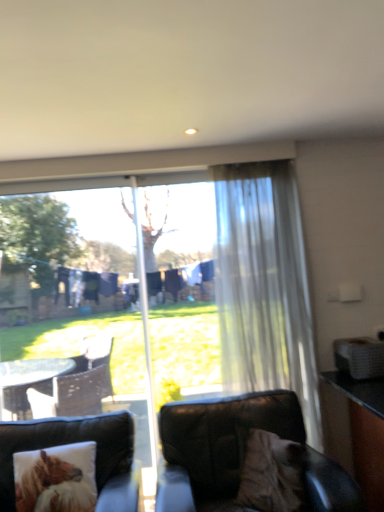
This screenshot has width=384, height=512. Describe the element at coordinates (68, 443) in the screenshot. I see `leather couch at lower left` at that location.

Where is `leather couch at lower left`? This screenshot has height=512, width=384. leather couch at lower left is located at coordinates (68, 443).

In the scene shown: Measure the distance between point (84, 453) and camera.

The depth of point (84, 453) is 7.46 feet.

Measure the distance between point (x=251, y=315) and camera.

Point (x=251, y=315) and camera are 2.75 meters apart.

You are a GUI agent. You are given a task and a screenshot of the screen. Output one action in this format:
    pyautogui.click(x=<x>, y=<y>)
    Task: Click on the black leather chair at lower right
    
    Given the screenshot: What is the action you would take?
    coord(239,454)

Considering the sizes of objects black leather chair at lower right and leather couch at lower left in the image provided, who is wider, black leather chair at lower right or leather couch at lower left?

leather couch at lower left is wider.

Looking at this image, do you think black leather chair at lower right is within leather couch at lower left, or outside of it?

black leather chair at lower right is not inside leather couch at lower left, it's outside.

Can you tell me how much beige fabric pillow at lower right and leather couch at lower left differ in facing direction?

They differ by 54.8 degrees in their facing directions.

Where is `pillow on the right side of leather couch at lower left`? pillow on the right side of leather couch at lower left is located at coordinates click(x=271, y=473).

Considering the sizes of objects beige fabric pillow at lower right and leather couch at lower left in the image provided, who is wider, beige fabric pillow at lower right or leather couch at lower left?

leather couch at lower left is wider.

Is beige fabric pillow at lower right spatially inside leather couch at lower left, or outside of it?

beige fabric pillow at lower right cannot be found inside leather couch at lower left.

In the scene shown: Can you tell me how much leather couch at lower left and beige fabric pillow at lower right differ in facing direction?

The angle between the facing direction of leather couch at lower left and the facing direction of beige fabric pillow at lower right is 54.8 degrees.

Considering the sizes of objects leather couch at lower left and beige fabric pillow at lower right in the image provided, who is shorter, leather couch at lower left or beige fabric pillow at lower right?

Standing shorter between the two is beige fabric pillow at lower right.

Would you say leather couch at lower left is outside beige fabric pillow at lower right?

Absolutely, leather couch at lower left is external to beige fabric pillow at lower right.

From the image's perspective, is leather couch at lower left on top of beige fabric pillow at lower right?

No, from the image's perspective, leather couch at lower left is not over beige fabric pillow at lower right.

From the image's perspective, is black leather chair at lower right under translucent white curtain at right?

Yes.

Considering the points (223, 431) and (276, 359), which point is behind, point (223, 431) or point (276, 359)?

The point (276, 359) is more distant.

Does black leather chair at lower right lie in front of translucent white curtain at right?

Yes, the depth of black leather chair at lower right is less than that of translucent white curtain at right.

Could you tell me if black leather chair at lower right is turned towards translucent white curtain at right?

No.

From the image's perspective, which one is positioned higher, fluffy brown pillow at lower left or beige fabric pillow at lower right?

beige fabric pillow at lower right.

Considering the sizes of objects fluffy brown pillow at lower left and beige fabric pillow at lower right in the image provided, who is thinner, fluffy brown pillow at lower left or beige fabric pillow at lower right?

With smaller width is fluffy brown pillow at lower left.

Could you tell me if fluffy brown pillow at lower left is turned towards beige fabric pillow at lower right?

No.

Is fluffy brown pillow at lower left next to beige fabric pillow at lower right and touching it?

No, fluffy brown pillow at lower left is not in contact with beige fabric pillow at lower right.

Considering the sizes of objects translucent white curtain at right and leather couch at lower left in the image provided, who is bigger, translucent white curtain at right or leather couch at lower left?

leather couch at lower left.

Is point (309, 398) positioned before point (119, 432)?

No, it is behind (119, 432).

From the image's perspective, relative to leather couch at lower left, is translucent white curtain at right above or below?

Clearly, from the image's perspective, translucent white curtain at right is above leather couch at lower left.

Looking at their sizes, would you say fluffy brown pillow at lower left is wider or thinner than translucent white curtain at right?

Considering their sizes, fluffy brown pillow at lower left looks broader than translucent white curtain at right.

I want to click on curtain behind the fluffy brown pillow at lower left, so click(264, 287).

Is fluffy brown pillow at lower left taller or shorter than translucent white curtain at right?

fluffy brown pillow at lower left is shorter than translucent white curtain at right.

Which object is positioned more to the left, fluffy brown pillow at lower left or translucent white curtain at right?

Positioned to the left is fluffy brown pillow at lower left.

At what (x,y) coordinates should I click in order to perform the action: click on chair on the right of leather couch at lower left. Please return your answer as a coordinate pair (x, y). Looking at the image, I should click on pos(239,454).

This screenshot has width=384, height=512. Identify the location of pillow positioned vertically above the leather couch at lower left (from a real-world perspective). (271, 473).

Based on their spatial positions, is fluffy brown pillow at lower left or leather couch at lower left closer to translucent white curtain at right?

Among the two, leather couch at lower left is located nearer to translucent white curtain at right.

Considering their positions, is black leather chair at lower right positioned closer to fluffy brown pillow at lower left than translucent white curtain at right?

black leather chair at lower right is positioned closer to the anchor fluffy brown pillow at lower left.

Which object lies nearer to the anchor point beige fabric pillow at lower right, black leather chair at lower right or fluffy brown pillow at lower left?

black leather chair at lower right is positioned closer to the anchor beige fabric pillow at lower right.

Which object lies further to the anchor point black leather chair at lower right, translucent white curtain at right or fluffy brown pillow at lower left?

fluffy brown pillow at lower left is positioned further to the anchor black leather chair at lower right.

Which object lies further to the anchor point fluffy brown pillow at lower left, translucent white curtain at right or beige fabric pillow at lower right?

The object further to fluffy brown pillow at lower left is translucent white curtain at right.

Looking at the image, which one is located closer to black leather chair at lower right, fluffy brown pillow at lower left or translucent white curtain at right?

translucent white curtain at right lies closer to black leather chair at lower right than the other object.

Based on their spatial positions, is leather couch at lower left or black leather chair at lower right further from fluffy brown pillow at lower left?

black leather chair at lower right is positioned further to the anchor fluffy brown pillow at lower left.

Based on their spatial positions, is black leather chair at lower right or translucent white curtain at right further from leather couch at lower left?

translucent white curtain at right.

Image resolution: width=384 pixels, height=512 pixels. What are the coordinates of `studio couch between fluffy brown pillow at lower left and black leather chair at lower right` in the screenshot? It's located at (68, 443).

What are the coordinates of `chair between fluffy brown pillow at lower left and beige fabric pillow at lower right` in the screenshot? It's located at (239, 454).

This screenshot has width=384, height=512. I want to click on chair between leather couch at lower left and beige fabric pillow at lower right in the horizontal direction, so click(239, 454).

Identify the location of chair situated between leather couch at lower left and translucent white curtain at right from left to right. The width and height of the screenshot is (384, 512). (239, 454).